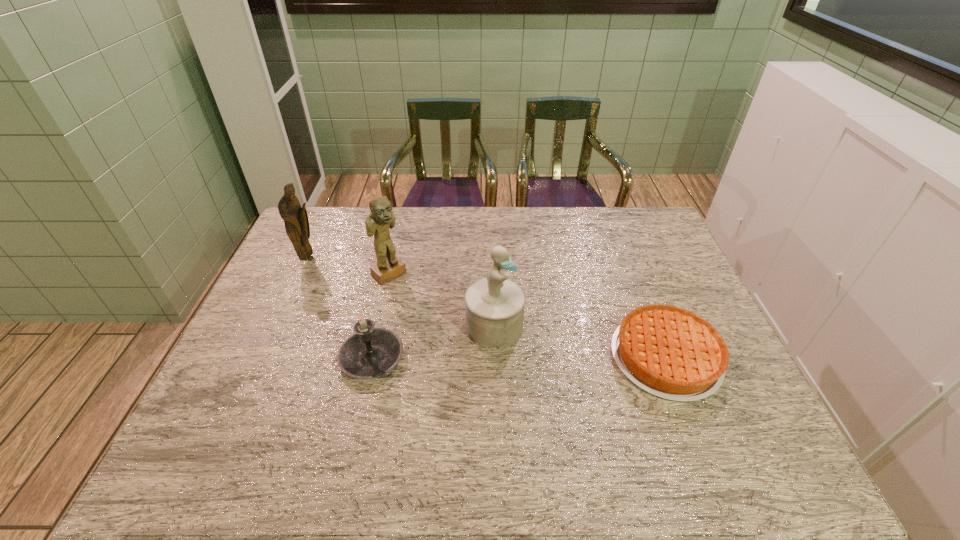
Find the location of a particular element. The height and width of the screenshot is (540, 960). object at the right edge is located at coordinates (672, 353).

Find the location of a particular element. This screenshot has width=960, height=540. object that is at the near right corner is located at coordinates (672, 353).

Identify the location of vacant area at the far edge. Image resolution: width=960 pixels, height=540 pixels. (597, 218).

Image resolution: width=960 pixels, height=540 pixels. What are the coordinates of `vacant position at the left edge of the desktop` in the screenshot? It's located at (292, 356).

Find the location of a particular element. free space at the right edge of the desktop is located at coordinates (685, 276).

Where is `vacant space at the far right corner`? vacant space at the far right corner is located at coordinates tap(643, 233).

At what (x,y) coordinates should I click in order to perform the action: click on free area in between the rightmost figurine and the pie. Please return your answer as a coordinate pair (x, y). Looking at the image, I should click on pos(580,342).

Locate an element on the screen. free space between the fourth tallest object and the leftmost figurine is located at coordinates (341, 308).

The image size is (960, 540). Find the location of `vacant space that's between the fourth tallest object and the pie`. vacant space that's between the fourth tallest object and the pie is located at coordinates (518, 357).

This screenshot has width=960, height=540. What are the coordinates of `free area in between the rightmost figurine and the second figurine from right to left` in the screenshot? It's located at (442, 300).